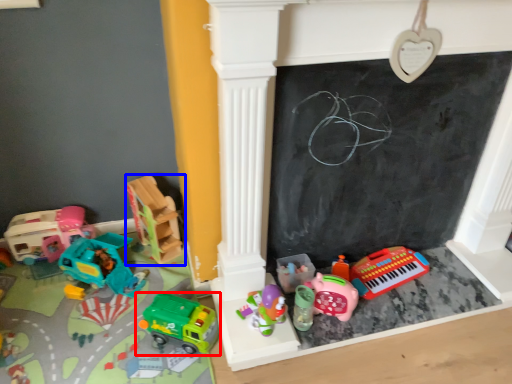
Question: Which of the following is the closest to the observer, toy (highlighted by a red box) or toy (highlighted by a blue box)?

Choices:
 (A) toy
 (B) toy

Answer: (A)